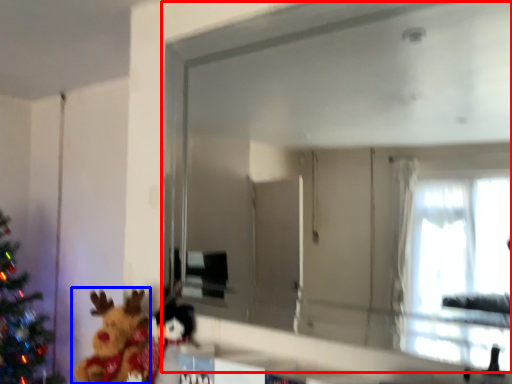
Question: Which object is closer to the camera taking this photo, mirror (highlighted by a red box) or toy (highlighted by a blue box)?

Choices:
 (A) mirror
 (B) toy

Answer: (A)